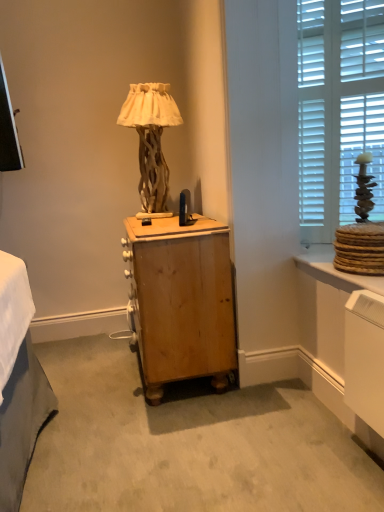
Question: Considering their positions, is wooden nightstand at center located in front of or behind matte wood vanity at lower right?

Choices:
 (A) behind
 (B) front

Answer: (A)

Question: Does point (147, 266) appear closer or farther from the camera than point (307, 267)?

Choices:
 (A) closer
 (B) farther

Answer: (A)

Question: Which of these objects is positioned closest to the white wood blinds at upper right?

Choices:
 (A) matte wood vanity at lower right
 (B) wooden textured lamp at center
 (C) wooden nightstand at center

Answer: (A)

Question: Based on their relative distances, which object is nearer to the white wood blinds at upper right?

Choices:
 (A) matte wood vanity at lower right
 (B) wooden nightstand at center
 (C) wooden textured lamp at center

Answer: (A)